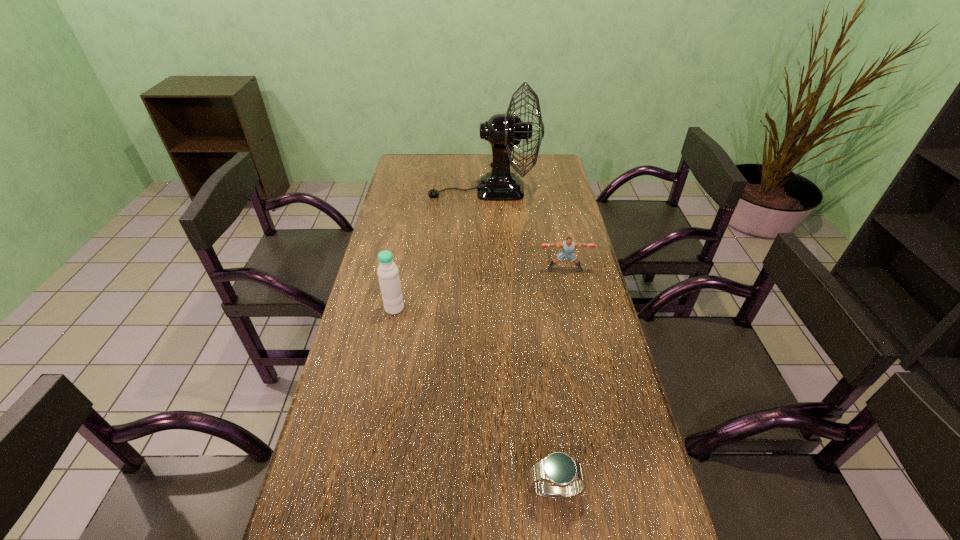
Find the location of `object located in the far left corner section of the desktop`. object located in the far left corner section of the desktop is located at coordinates (504, 131).

The height and width of the screenshot is (540, 960). Find the location of `object located at the far right corner`. object located at the far right corner is located at coordinates (504, 131).

In the image, there is a desktop. Where is `vacant space at the far edge`? The width and height of the screenshot is (960, 540). vacant space at the far edge is located at coordinates (464, 170).

Where is `vacant space at the left edge of the desktop`? Image resolution: width=960 pixels, height=540 pixels. vacant space at the left edge of the desktop is located at coordinates (355, 332).

At what (x,y) coordinates should I click in order to perform the action: click on free space at the right edge of the desktop. Please return your answer as a coordinate pair (x, y). The width and height of the screenshot is (960, 540). Looking at the image, I should click on (575, 347).

Where is `vacant space at the far left corner of the desktop`? The image size is (960, 540). vacant space at the far left corner of the desktop is located at coordinates (424, 178).

You are a GUI agent. You are given a task and a screenshot of the screen. Output one action in this format:
    pyautogui.click(x=<x>, y=<y>)
    Task: Click on the vacant space at the far right corner of the desktop
    
    Given the screenshot: What is the action you would take?
    pyautogui.click(x=537, y=164)

Where is `free spot between the tallest object and the watch`? The height and width of the screenshot is (540, 960). free spot between the tallest object and the watch is located at coordinates (519, 341).

I want to click on free area in between the tallest object and the shortest object, so click(519, 341).

Find the location of a particular element. vacant space that's between the water bottle and the tallest object is located at coordinates coord(439,249).